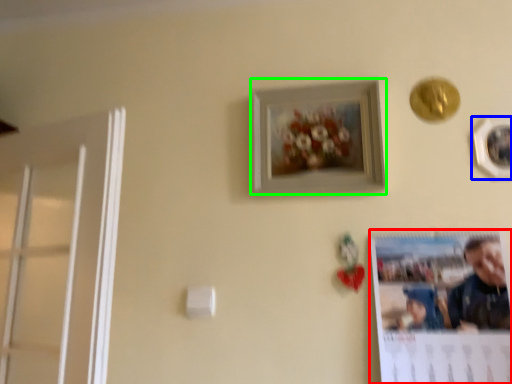
Question: Which is nearer to the poster page (highlighted by a red box)? picture frame (highlighted by a blue box) or picture frame (highlighted by a green box).

Choices:
 (A) picture frame
 (B) picture frame

Answer: (B)